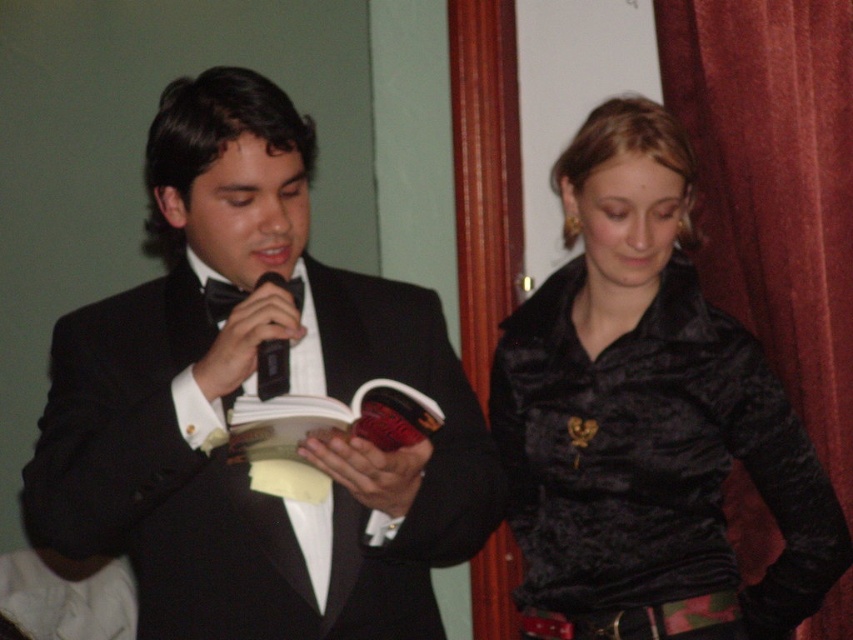
Question: Which object is closer to the camera taking this photo?

Choices:
 (A) black satin tuxedo at center
 (B) velvet red curtain at right

Answer: (A)

Question: Which point appears farthest from the camera in this image?

Choices:
 (A) (268, 272)
 (B) (265, 317)

Answer: (A)

Question: From the image, what is the correct spatial relationship of black satin tuxedo at center in relation to velvet red curtain at right?

Choices:
 (A) right
 (B) left

Answer: (B)

Question: Does velvet red curtain at right appear under black satin bow tie at upper left?

Choices:
 (A) yes
 (B) no

Answer: (B)

Question: Which object is farther from the camera taking this photo?

Choices:
 (A) velvet red curtain at right
 (B) black satin tuxedo at center

Answer: (A)

Question: Can you confirm if black satin tuxedo at center is wider than black velvet jacket at center?

Choices:
 (A) no
 (B) yes

Answer: (B)